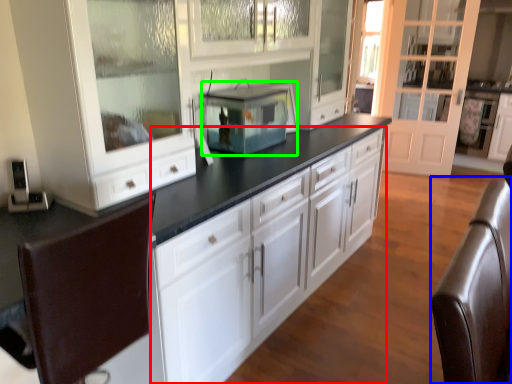
Question: Which object is the farthest from cabinetry (highlighted by a red box)? Choose among these: swivel chair (highlighted by a blue box) or home appliance (highlighted by a green box).

Choices:
 (A) swivel chair
 (B) home appliance

Answer: (A)